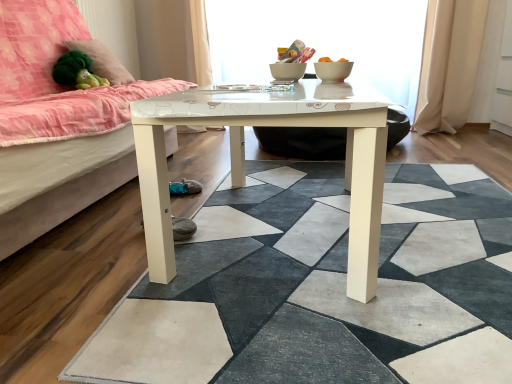
Where is `free space on the front side of beige fabric curtain at right`? Image resolution: width=512 pixels, height=384 pixels. free space on the front side of beige fabric curtain at right is located at coordinates (464, 140).